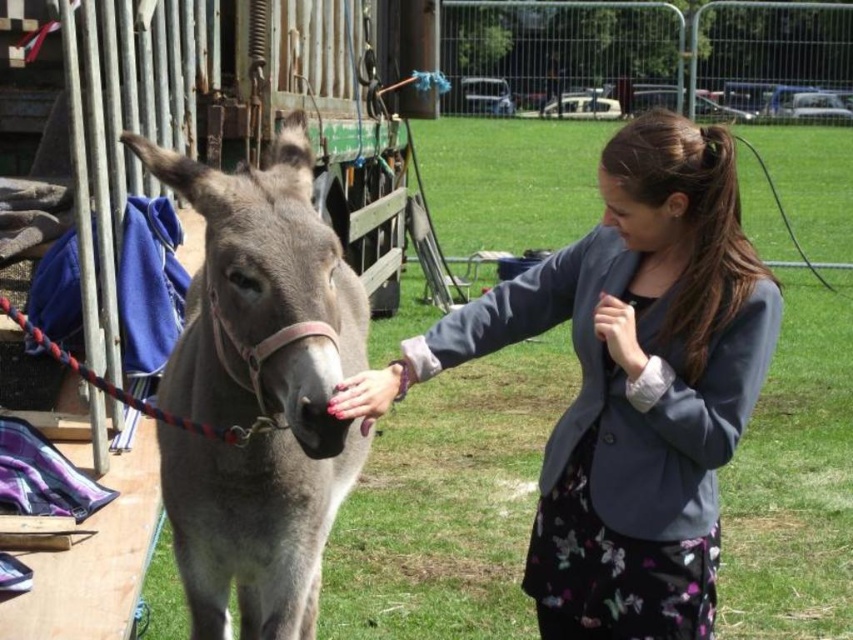
Question: Which object is farther from the camera taking this photo?

Choices:
 (A) gray matte donkey at center
 (B) matte gray blazer at center

Answer: (B)

Question: Can you confirm if matte gray blazer at center is thinner than gray matte donkey at center?

Choices:
 (A) no
 (B) yes

Answer: (A)

Question: Is matte gray blazer at center smaller than gray matte donkey at center?

Choices:
 (A) no
 (B) yes

Answer: (B)

Question: Which point appears closest to the camera in this image?

Choices:
 (A) [318, 518]
 (B) [641, 417]

Answer: (B)

Question: Can you confirm if matte gray blazer at center is wider than gray matte donkey at center?

Choices:
 (A) yes
 (B) no

Answer: (A)